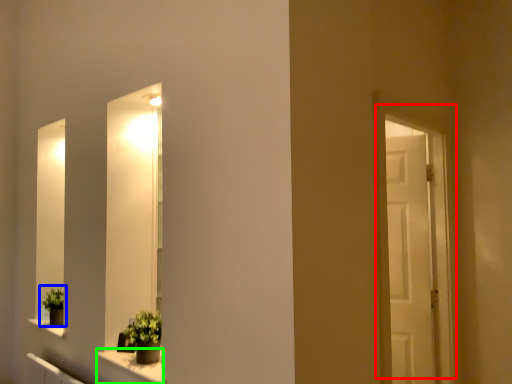
Question: Which is nearer to the door (highlighted by a red box)? houseplant (highlighted by a blue box) or window sill (highlighted by a green box).

Choices:
 (A) houseplant
 (B) window sill

Answer: (B)